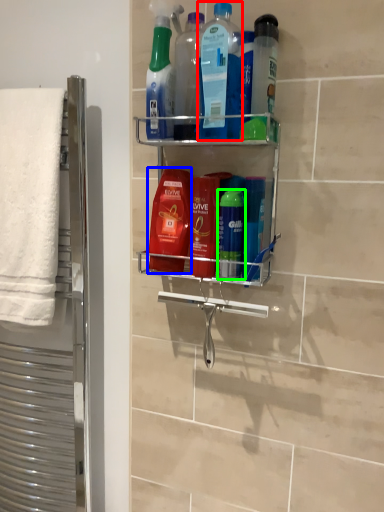
Question: Which object is positioned farthest from cleaning product (highlighted by a red box)? Select from cleaning product (highlighted by a blue box) and mouthwash (highlighted by a green box).

Choices:
 (A) cleaning product
 (B) mouthwash

Answer: (B)